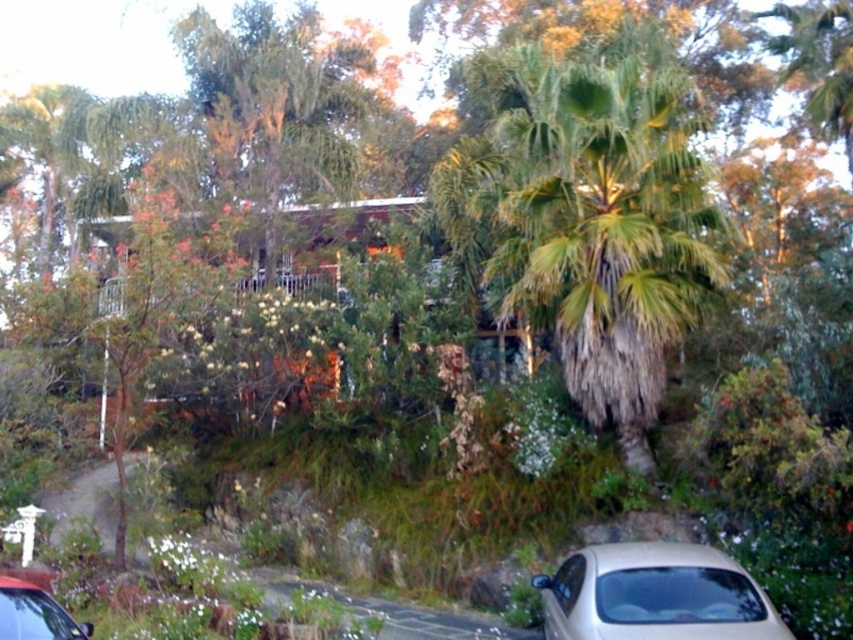
You are a delivery person trying to park your delivery van, which is 2 meters tall, in this driveway. You see the beige matte car at lower right and the metallic silver car at lower left parked there. Can your van fit between them without hitting the cars?

The beige matte car at lower right is much taller than metallic silver car at lower left. Since your van is 2 meters tall, you need to check the height clearance between the cars. However, the description only mentions the height comparison between the two cars, not the available vertical space between them. Without information on the vertical distance between the cars, it is uncertain if the van can fit without hitting the taller beige matte car at lower right.

You are a delivery person arriving at this house and need to park your delivery van between the beige matte car at lower right and the metallic silver car at lower left. Is there enough space between them for your van, which is 6 meters long?

The beige matte car at lower right is located below the metallic silver car at lower left, but the distance between them isn not specified in the objects description. Therefore, it is impossible to determine if there is enough space for the van.